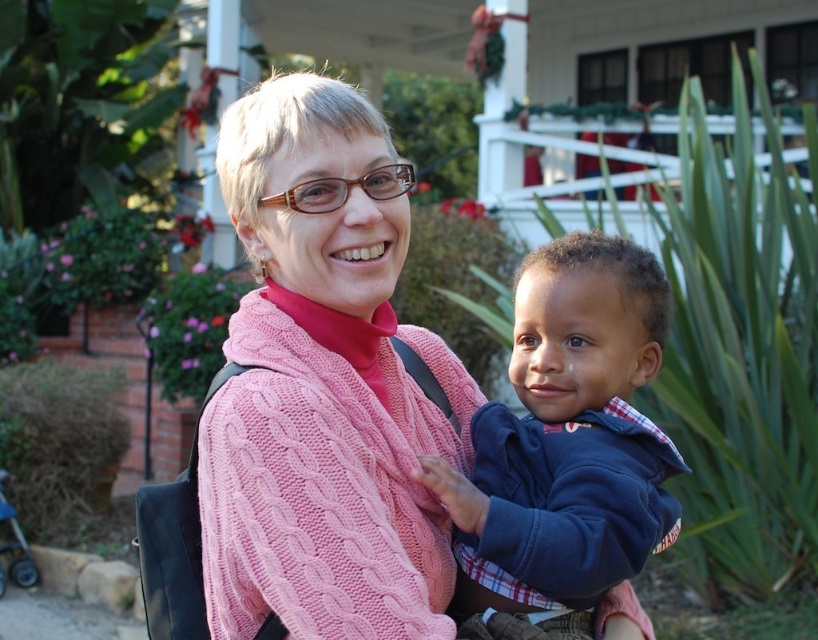
You are a photographer standing at the camera position. You want to capture a closeup of the pink knitted sweater at center. Given that your camera has a minimum focusing distance of 5 feet, will you be able to take the photo without moving closer?

The pink knitted sweater at center is 7.88 feet from camera. Since the minimum focusing distance is 5 feet, you need to move closer to 5 feet or less to capture the closeup.